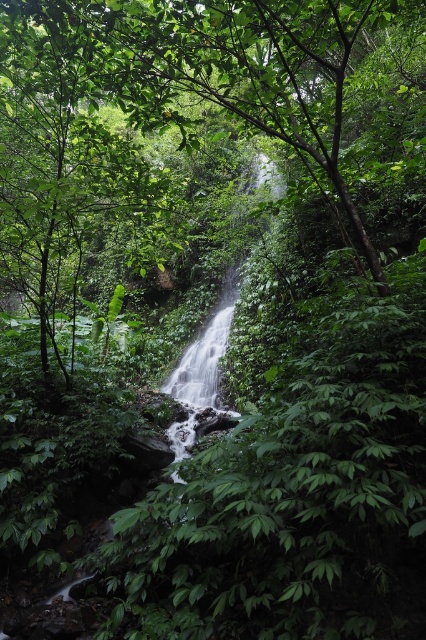
Question: Among these objects, which one is nearest to the camera?

Choices:
 (A) green leafy waterfall at center
 (B) green leafy tree at center

Answer: (B)

Question: Is green leafy tree at center above green leafy waterfall at center?

Choices:
 (A) no
 (B) yes

Answer: (B)

Question: Is green leafy tree at center closer to camera compared to green leafy waterfall at center?

Choices:
 (A) yes
 (B) no

Answer: (A)

Question: Can you confirm if green leafy tree at center is thinner than green leafy waterfall at center?

Choices:
 (A) no
 (B) yes

Answer: (A)

Question: Which object is closer to the camera taking this photo?

Choices:
 (A) green leafy tree at center
 (B) green leafy waterfall at center

Answer: (A)

Question: Which of the following is the closest to the observer?

Choices:
 (A) green leafy tree at center
 (B) green leafy waterfall at center

Answer: (A)